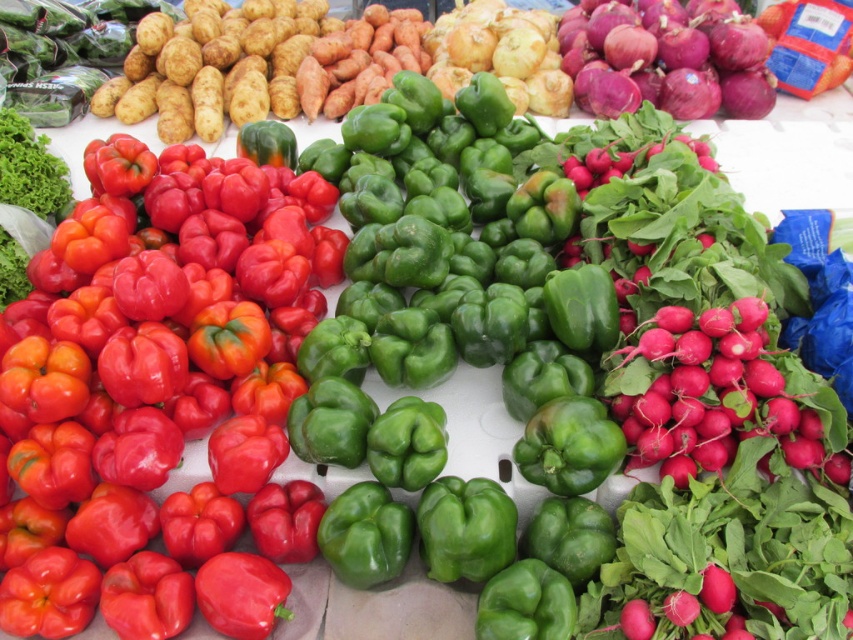
You are a customer at the market stall and want to grab both the shiny red bell pepper at left and the purple smooth onion at upper right. Which one should you reach for first if you want to pick up the one closer to you?

The shiny red bell pepper at left is closer to you since it is positioned on the left side of the purple smooth onion at upper right.

You are a customer at the market stall and want to pick up the shiny red bell pepper at left and the purple smooth onion at upper right. Which one do you need to reach down to get?

You need to reach down to get the shiny red bell pepper at left because it is located below the purple smooth onion at upper right.

You are standing at the market stall looking at the produce. You notice two points marked in the image. Which point, point 1 at coordinates (x=196, y=492) or point 2 at coordinates (x=668, y=12), is closer to you?

Point 1 at coordinates (x=196, y=492) is closer to you because it is in front of point 2 at coordinates (x=668, y=12).